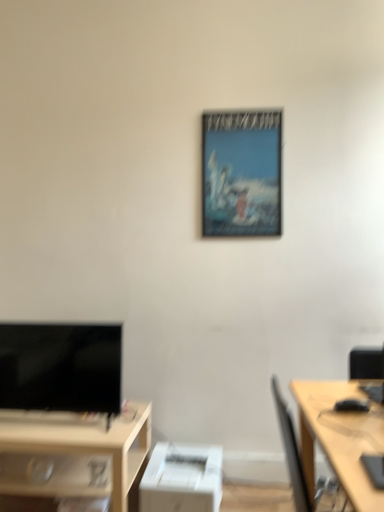
Question: Should I look upward or downward to see light wood desk at right, placed as the 1th desk when sorted from top to bottom?

Choices:
 (A) down
 (B) up

Answer: (A)

Question: Considering the relative sizes of black glossy tv at lower left and metallic poster at center in the image provided, is black glossy tv at lower left smaller than metallic poster at center?

Choices:
 (A) no
 (B) yes

Answer: (A)

Question: Is black glossy tv at lower left further to the viewer compared to metallic poster at center?

Choices:
 (A) no
 (B) yes

Answer: (A)

Question: Considering the relative positions of black glossy tv at lower left and metallic poster at center in the image provided, is black glossy tv at lower left to the left of metallic poster at center from the viewer's perspective?

Choices:
 (A) no
 (B) yes

Answer: (B)

Question: Is black glossy tv at lower left at the right side of metallic poster at center?

Choices:
 (A) no
 (B) yes

Answer: (A)

Question: Does black glossy tv at lower left turn towards metallic poster at center?

Choices:
 (A) yes
 (B) no

Answer: (B)

Question: Would you say black glossy tv at lower left is outside metallic poster at center?

Choices:
 (A) yes
 (B) no

Answer: (A)

Question: Is black glossy tv at lower left thinner than white matte printer at lower center?

Choices:
 (A) no
 (B) yes

Answer: (B)

Question: Considering the relative sizes of black glossy tv at lower left and white matte printer at lower center in the image provided, is black glossy tv at lower left smaller than white matte printer at lower center?

Choices:
 (A) no
 (B) yes

Answer: (A)

Question: Considering the relative sizes of black glossy tv at lower left and white matte printer at lower center in the image provided, is black glossy tv at lower left shorter than white matte printer at lower center?

Choices:
 (A) yes
 (B) no

Answer: (B)

Question: Is black glossy tv at lower left positioned behind white matte printer at lower center?

Choices:
 (A) yes
 (B) no

Answer: (A)

Question: Considering the relative sizes of black glossy tv at lower left and white matte printer at lower center in the image provided, is black glossy tv at lower left wider than white matte printer at lower center?

Choices:
 (A) no
 (B) yes

Answer: (A)

Question: From a real-world perspective, is black glossy tv at lower left below white matte printer at lower center?

Choices:
 (A) yes
 (B) no

Answer: (B)

Question: Is white matte printer at lower center smaller than black glossy tv at lower left?

Choices:
 (A) no
 (B) yes

Answer: (B)